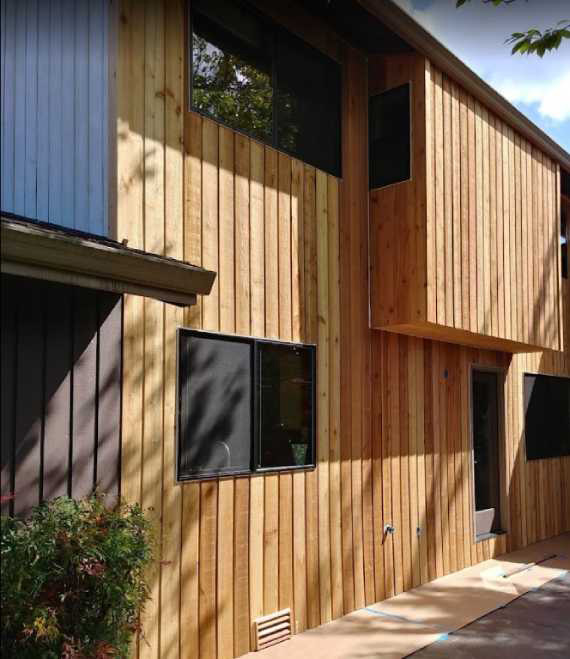
At what (x,y) coordinates should I click in order to perform the action: click on vents. Please return your answer as a coordinate pair (x, y). The height and width of the screenshot is (659, 570). Looking at the image, I should click on (264, 631).